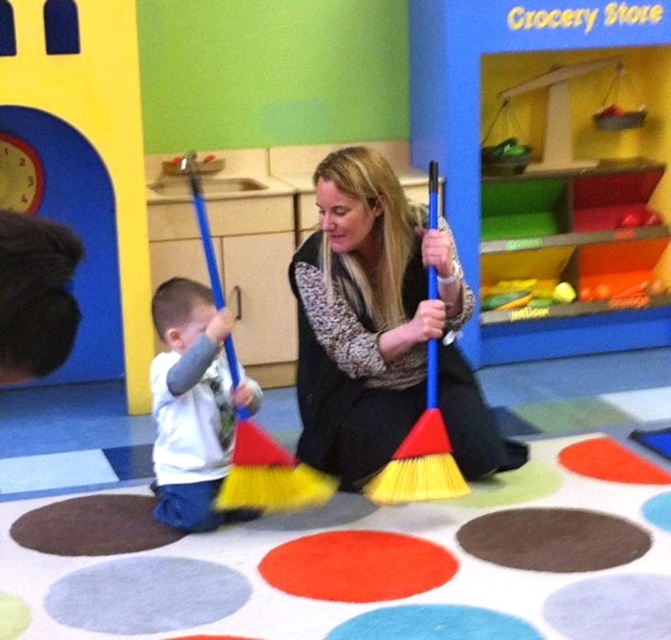
You are a parent trying to decide which item to buy for your child between the matte blue broom at center and the white soft shirt at lower left. Based on the size, which one is bigger?

The matte blue broom at center is larger in size than the white soft shirt at lower left, so the matte blue broom at center is bigger.